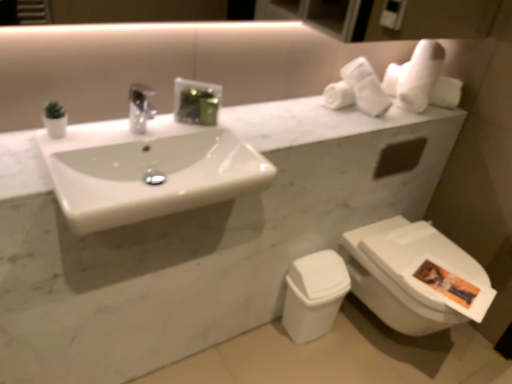
The height and width of the screenshot is (384, 512). I want to click on blank area beneath white glossy toilet at lower right (from a real-world perspective), so click(389, 339).